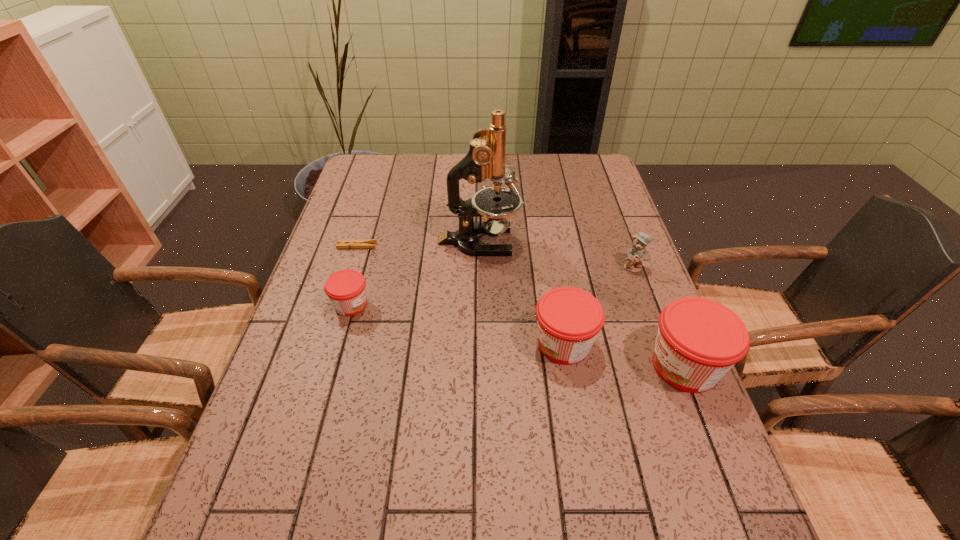
Identify the location of free spot that satisfies the following two spatial constraints: 1. on the front-facing side of the fourth nearest object; 2. on the label side of the shortest jam. The image size is (960, 540). (648, 305).

Where is `free space that satisfies the following two spatial constraints: 1. on the front-facing side of the third farthest object; 2. on the label side of the second jam from left to right`? This screenshot has width=960, height=540. free space that satisfies the following two spatial constraints: 1. on the front-facing side of the third farthest object; 2. on the label side of the second jam from left to right is located at coordinates (662, 344).

Locate an element on the screen. The width and height of the screenshot is (960, 540). free spot that satisfies the following two spatial constraints: 1. at the eyepiece of the third object from left to right; 2. on the front side of the shortest object is located at coordinates (479, 246).

Find the location of `vacant region that satisfies the following two spatial constraints: 1. on the front-facing side of the fourth nearest object; 2. on the label side of the shortest jam`. vacant region that satisfies the following two spatial constraints: 1. on the front-facing side of the fourth nearest object; 2. on the label side of the shortest jam is located at coordinates (648, 305).